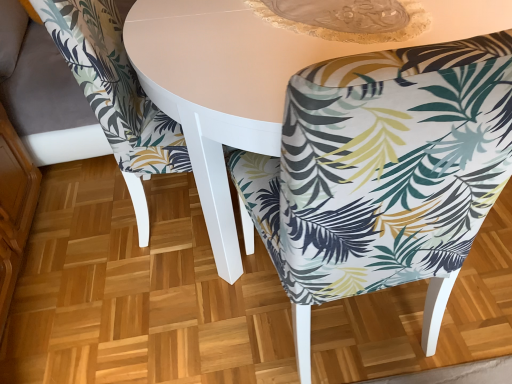
Question: Looking at the image, does printed fabric chair at center, which ranks as the 2th chair in left-to-right order, seem bigger or smaller compared to white glossy table at center?

Choices:
 (A) big
 (B) small

Answer: (B)

Question: From a real-world perspective, is printed fabric chair at center, which ranks as the 2th chair in left-to-right order, physically located above or below white glossy table at center?

Choices:
 (A) above
 (B) below

Answer: (A)

Question: Estimate the real-world distances between objects in this image. Which object is farther from the printed fabric chair at center, arranged as the 1th chair when viewed from the left?

Choices:
 (A) white glossy table at center
 (B) printed fabric chair at center, placed as the first chair when sorted from right to left

Answer: (B)

Question: Based on their relative distances, which object is nearer to the printed fabric chair at center, placed as the first chair when sorted from right to left?

Choices:
 (A) printed fabric chair at center, arranged as the 1th chair when viewed from the left
 (B) white glossy table at center

Answer: (B)